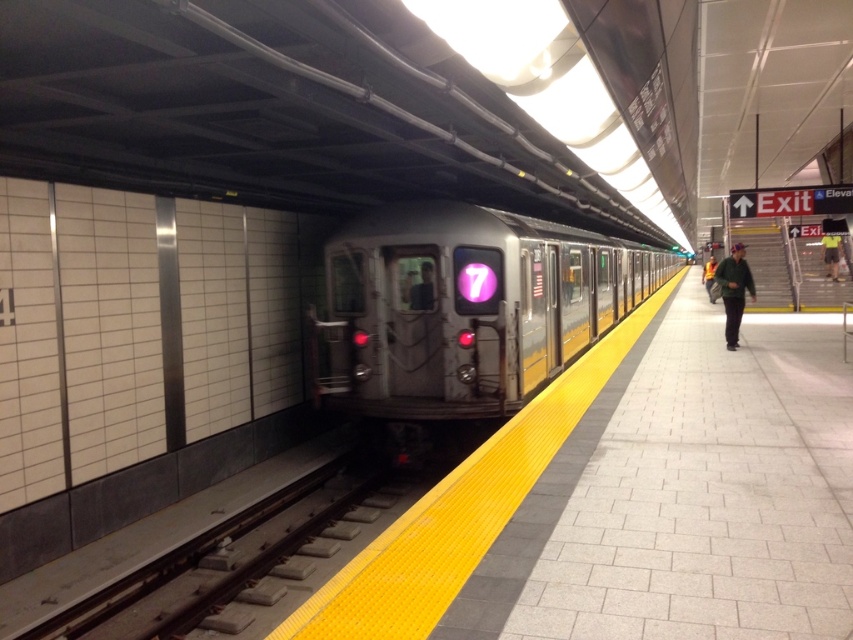
You are a passenger waiting on the subway platform and see a green fabric jacket at right and a yellow reflective vest at center. Which item is closer to the train doors?

The green fabric jacket at right is positioned on the left side of yellow reflective vest at center, so the yellow reflective vest at center is closer to the train doors since it is further to the right than the jacket.

You are standing on the subway platform and want to determine the relative positions of two points marked on the platform. The first point is at coordinates point (448,362) and the second is at point (749,289). Based on the scene description, which point is closer to you?

Point (448,362) is closer to the viewer than point (749,289).